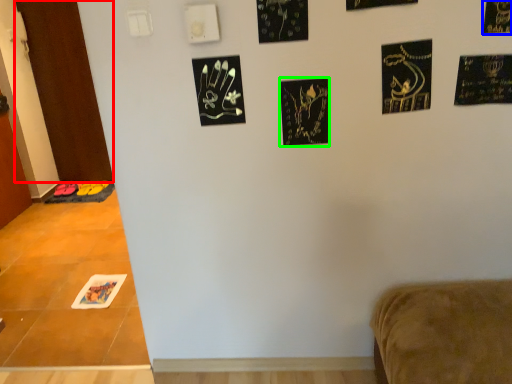
Question: Considering the real-world distances, which object is closest to door (highlighted by a red box)? print (highlighted by a blue box) or print (highlighted by a green box).

Choices:
 (A) print
 (B) print

Answer: (B)